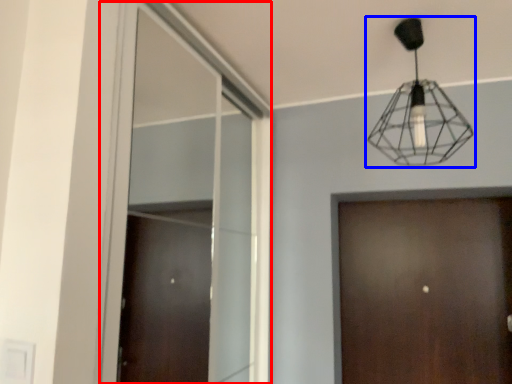
Question: Which object is further to the camera taking this photo, window (highlighted by a red box) or lamp (highlighted by a blue box)?

Choices:
 (A) window
 (B) lamp

Answer: (B)